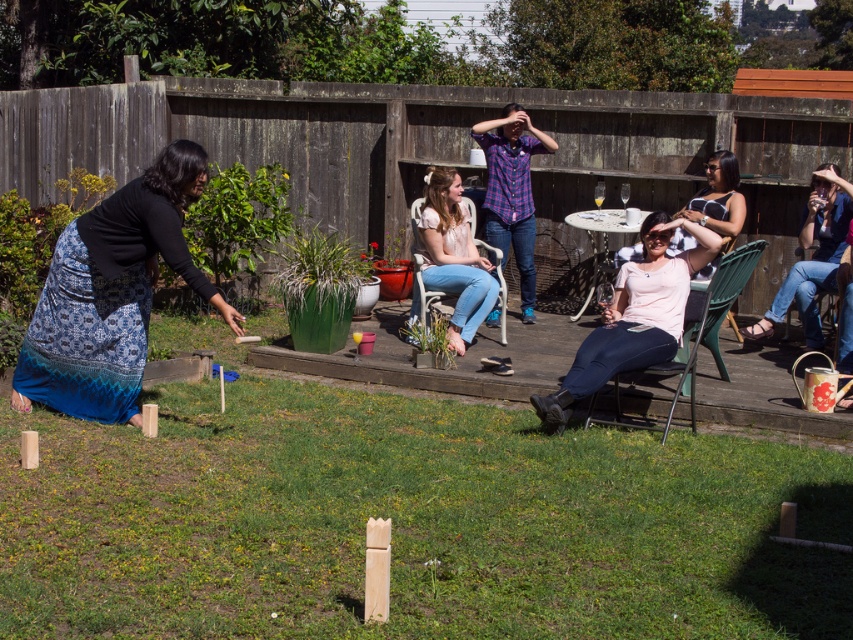
Between blue jeans at right and matte pink shirt at center, which one is positioned lower?

Positioned lower is blue jeans at right.

Between blue jeans at right and matte pink shirt at center, which one is positioned higher?

matte pink shirt at center

The height and width of the screenshot is (640, 853). In order to click on blue jeans at right in this screenshot , I will do `click(811, 256)`.

Image resolution: width=853 pixels, height=640 pixels. I want to click on blue jeans at right, so click(x=811, y=256).

Does point (596, 618) come in front of point (839, 348)?

Yes, it is.

Between natural grass at center and denim fabric chair at right, which one is positioned higher?

denim fabric chair at right is above.

Is point (0, 460) positioned before point (770, 308)?

Yes.

Locate an element on the screen. natural grass at center is located at coordinates (408, 524).

Does natural grass at center have a lesser height compared to denim fabric chair at center?

Yes, natural grass at center is shorter than denim fabric chair at center.

Who is taller, natural grass at center or denim fabric chair at center?

denim fabric chair at center

Locate an element on the screen. natural grass at center is located at coordinates (408, 524).